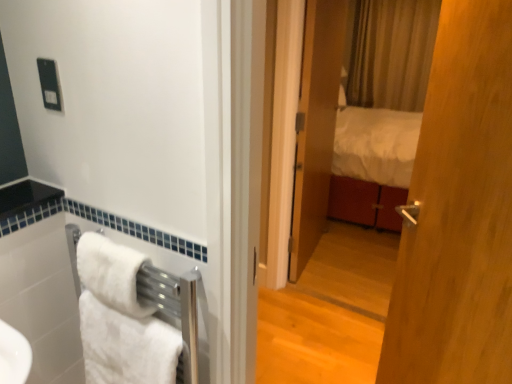
You are a GUI agent. You are given a task and a screenshot of the screen. Output one action in this format:
    pyautogui.click(x=<x>, y=<y>)
    Task: Click on the vacant area located to the right-hand side of wooden door at center
    
    Given the screenshot: What is the action you would take?
    pyautogui.click(x=352, y=256)